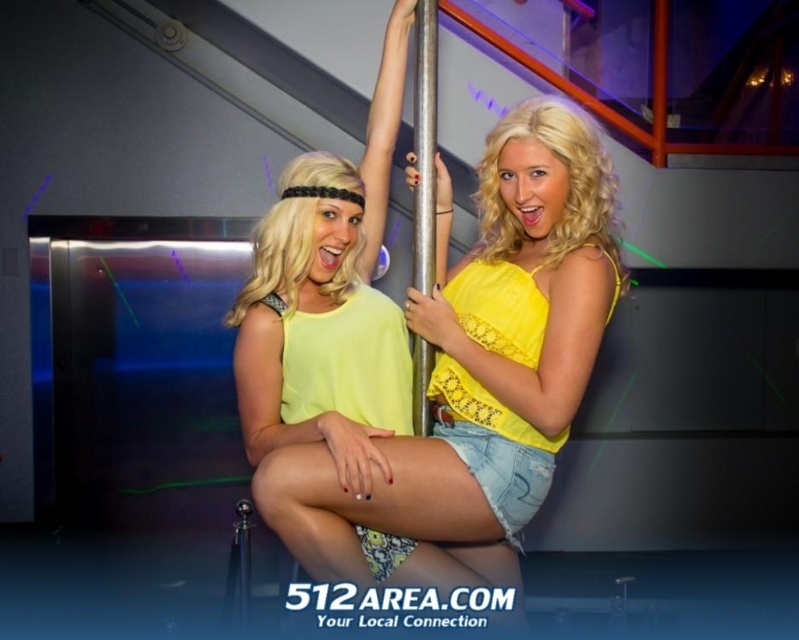
You are a photographer setting up for a photoshoot in the nightclub scene. You need to ensure that the yellow denim shorts at center and the metallic pole at center are both visible in the frame. Considering their widths, which object should you position closer to the camera to maintain clarity in the photo?

The yellow denim shorts at center is wider than the metallic pole at center. To maintain clarity, position the yellow denim shorts at center closer to the camera since its greater width requires more focus area.

You are a photographer standing in front of the nightclub scene. You want to capture a photo where the yellow denim shorts at center and the metallic pole at center are both clearly visible. Which object is positioned closer to the camera, allowing it to be in focus without needing to adjust the camera focus for the other?

The yellow denim shorts at center is closer to the viewer than the metallic pole at center, so the photographer can focus on the yellow denim shorts at center and the metallic pole at center will still be in focus if the depth of field is sufficient.

Based on the scene description, where is the yellow denim shorts at center located in terms of coordinates?

The yellow denim shorts at center is located at coordinates point (476, 372).